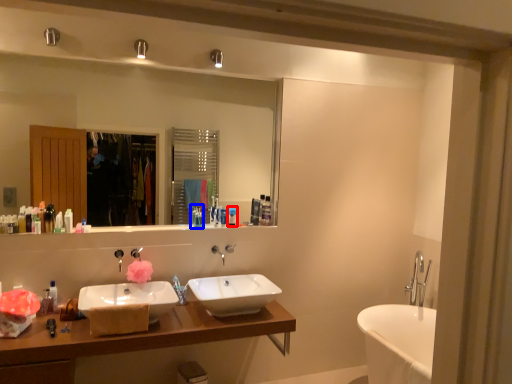
Question: Which point is closer to the camera, toiletry (highlighted by a red box) or toiletry (highlighted by a blue box)?

Choices:
 (A) toiletry
 (B) toiletry

Answer: (B)